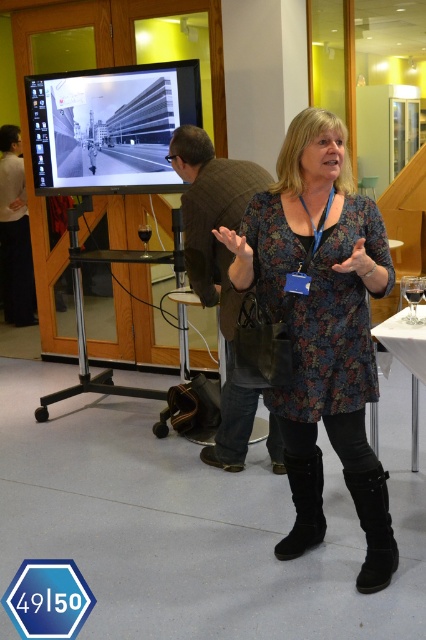
Question: Is floral print dress at center to the right of matte black laptop at left from the viewer's perspective?

Choices:
 (A) no
 (B) yes

Answer: (B)

Question: Estimate the real-world distances between objects in this image. Which object is farther from the floral print dress at center?

Choices:
 (A) black suede boot at lower center
 (B) matte black laptop at left

Answer: (B)

Question: Which of these objects is positioned closest to the black suede boot at lower center?

Choices:
 (A) black suede boot at center
 (B) white glossy table at lower right

Answer: (A)

Question: Which point is farther to the camera?

Choices:
 (A) (333, 330)
 (B) (305, 547)
 (C) (385, 356)
 (D) (382, 470)

Answer: (C)

Question: Can you confirm if matte black laptop at left is thinner than black suede boot at lower center?

Choices:
 (A) yes
 (B) no

Answer: (B)

Question: Does matte black laptop at left lie in front of white glossy table at lower right?

Choices:
 (A) yes
 (B) no

Answer: (B)